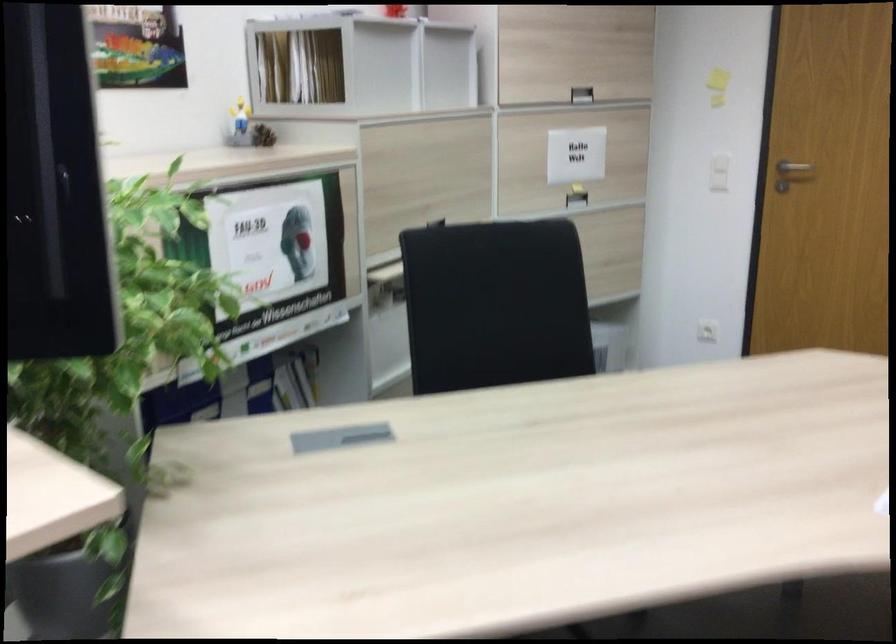
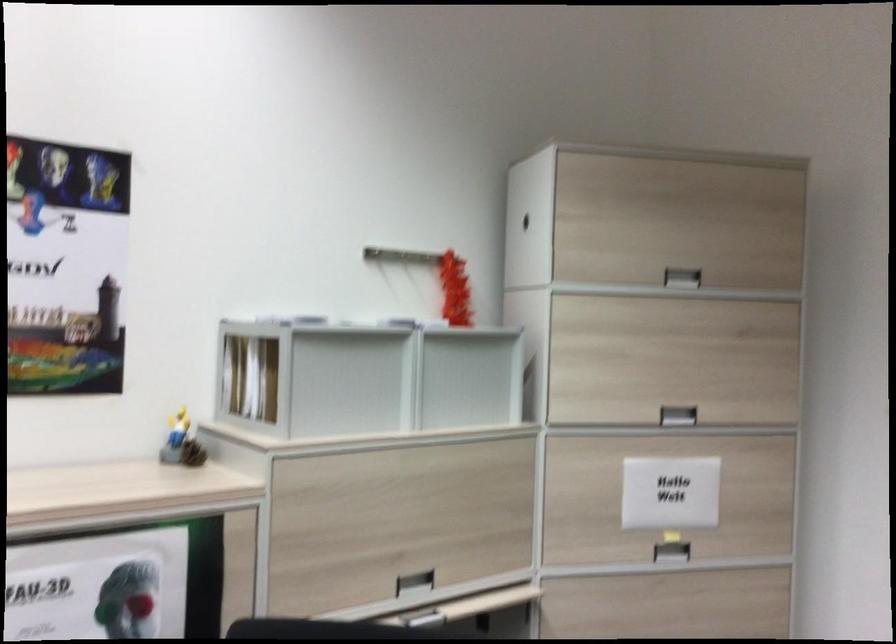
Where in the second image is the point corresponding to [582,93] from the first image?

(677, 415)